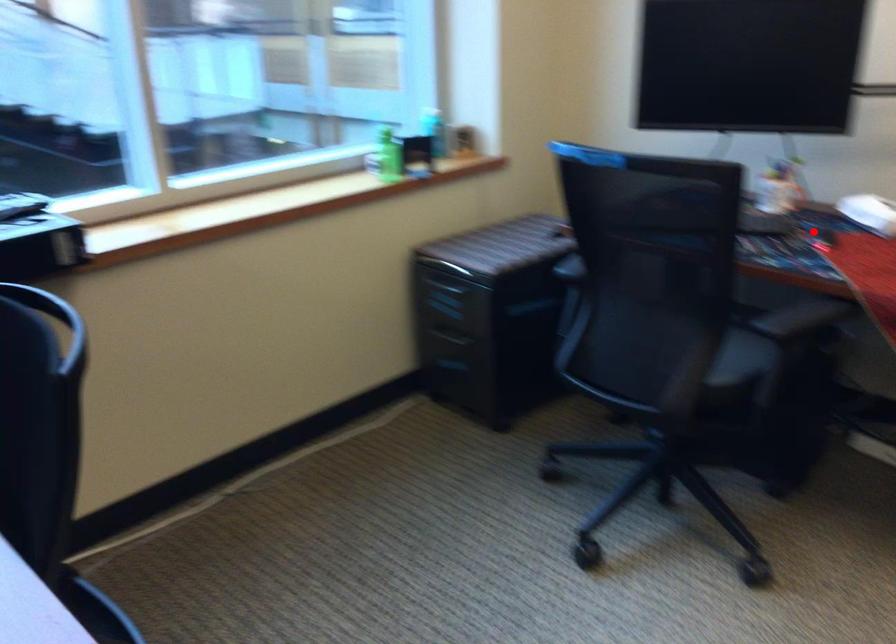
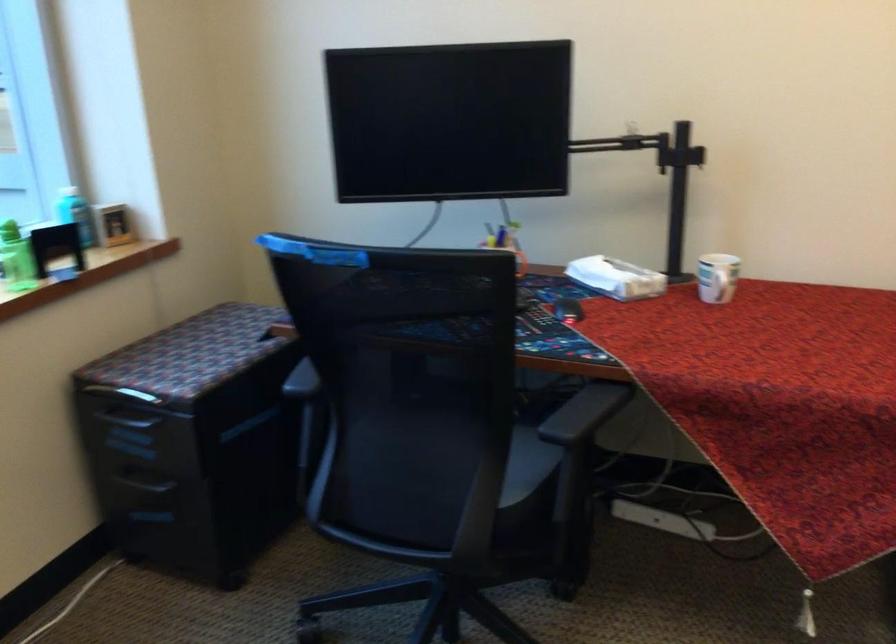
Question: I am providing you with two images of the same scene from different viewpoints. A red point is shown in image1. For the corresponding object point in image2, is it positioned nearer or farther from the camera?

Choices:
 (A) Nearer
 (B) Farther

Answer: (A)